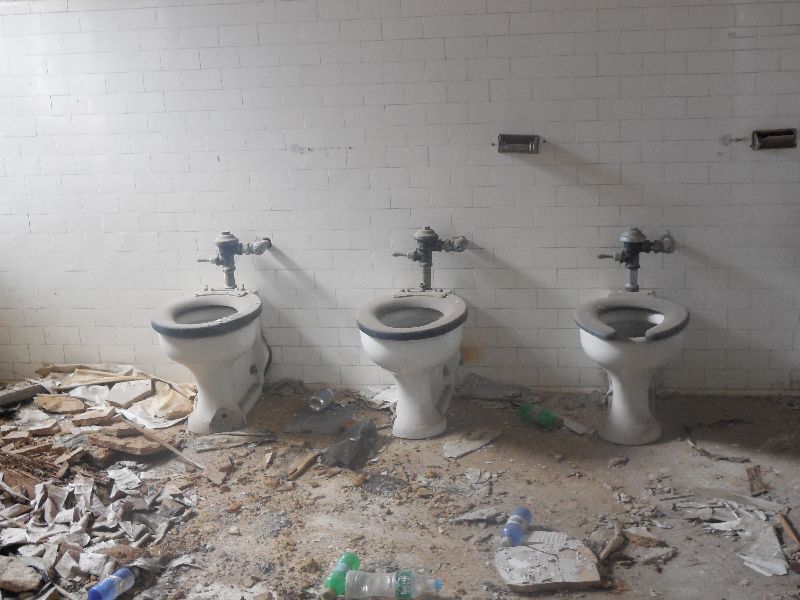
Locate an element on the screen. bottle is located at coordinates (117, 585).